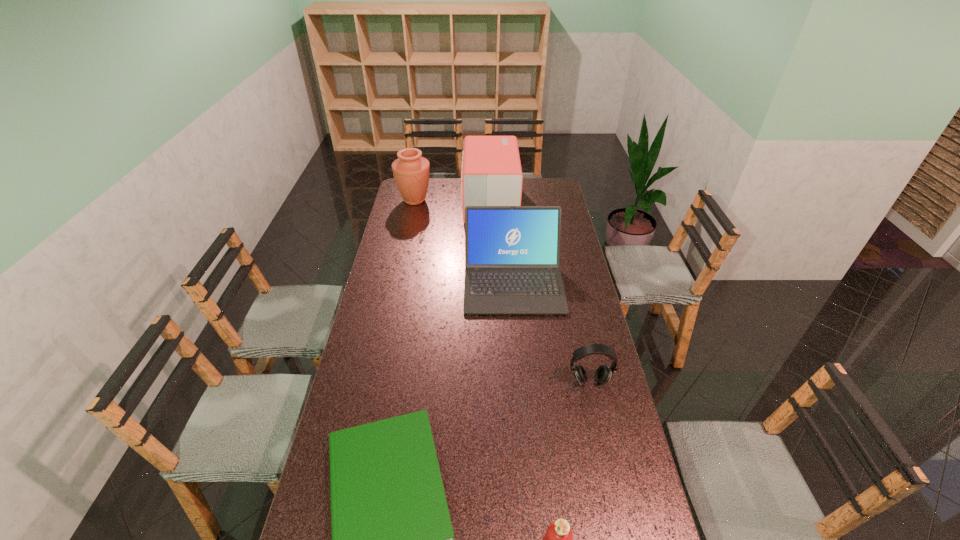
Find the location of a particular element. Image resolution: width=960 pixels, height=540 pixels. free spot between the vase and the box is located at coordinates (452, 201).

In order to click on object that stands as the third closest to the paperback book in this screenshot , I will do `click(512, 253)`.

This screenshot has width=960, height=540. What are the coordinates of `the second closest object to the fruit juice` in the screenshot? It's located at (603, 373).